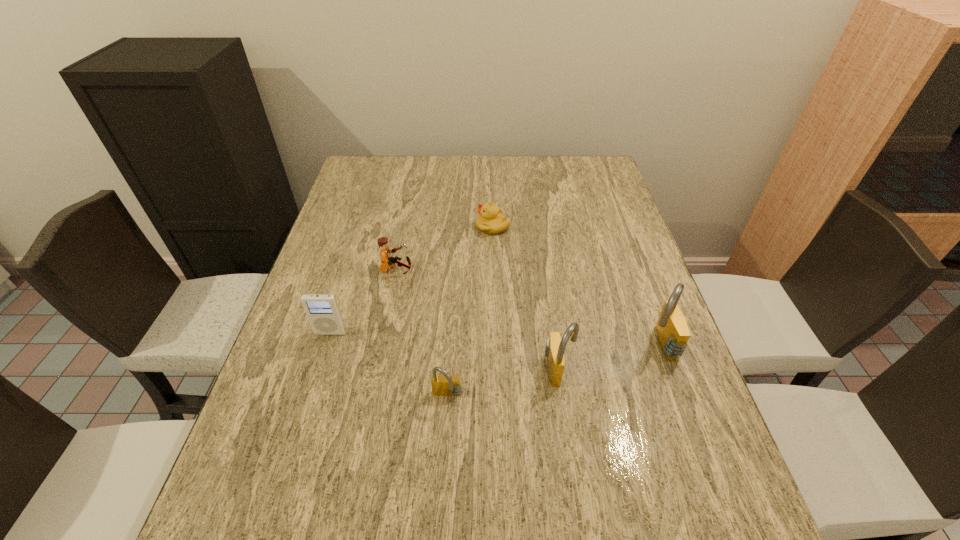
The height and width of the screenshot is (540, 960). In order to click on free area in between the leftmost object and the rightmost object in this screenshot , I will do `click(495, 339)`.

This screenshot has height=540, width=960. In order to click on unoccupied position between the shortest object and the Lego in this screenshot , I will do `click(444, 248)`.

Image resolution: width=960 pixels, height=540 pixels. What are the coordinates of `unoccupied position between the shortest padlock and the iPod` in the screenshot? It's located at (389, 364).

Where is `vacant space that's between the second shortest padlock and the third tallest object`? This screenshot has height=540, width=960. vacant space that's between the second shortest padlock and the third tallest object is located at coordinates (444, 351).

Locate an element on the screen. Image resolution: width=960 pixels, height=540 pixels. empty space between the third tallest object and the duckling is located at coordinates point(412,280).

Where is `empty location between the rightmost padlock and the fourth shortest object`? Image resolution: width=960 pixels, height=540 pixels. empty location between the rightmost padlock and the fourth shortest object is located at coordinates (495, 339).

This screenshot has width=960, height=540. I want to click on free area in between the third object from right to left and the nearest padlock, so click(470, 311).

The height and width of the screenshot is (540, 960). What are the coordinates of `free space between the rightmost object and the iPod` in the screenshot? It's located at (495, 339).

You are a GUI agent. You are given a task and a screenshot of the screen. Output one action in this format:
    pyautogui.click(x=<x>, y=<y>)
    Task: Click on the free space between the second farthest object and the second tallest padlock
    
    Given the screenshot: What is the action you would take?
    pyautogui.click(x=478, y=320)

Where is `blank region between the Lego and the leftmost padlock`? This screenshot has height=540, width=960. blank region between the Lego and the leftmost padlock is located at coordinates (421, 333).